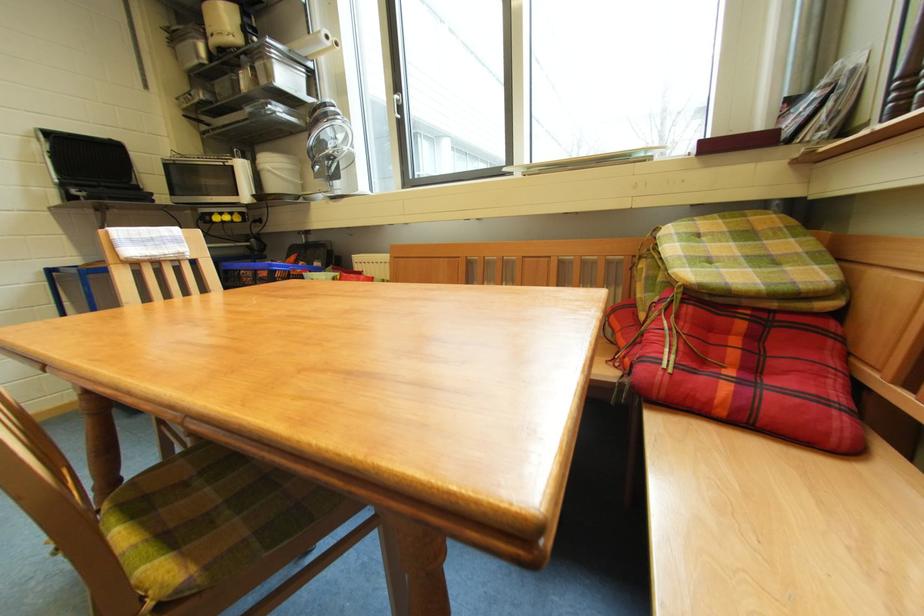
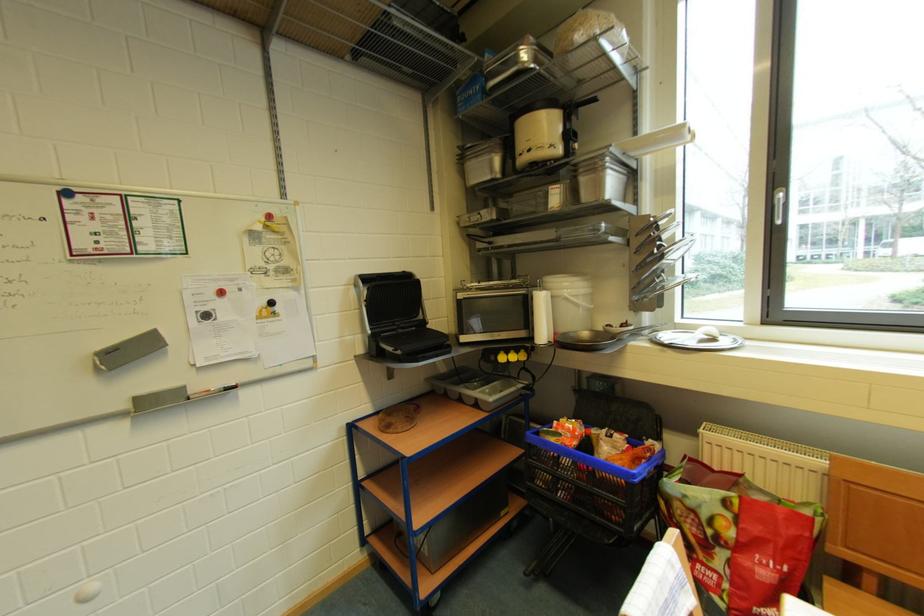
Find the pixel in the second image that matches (281,171) in the first image.

(578, 299)